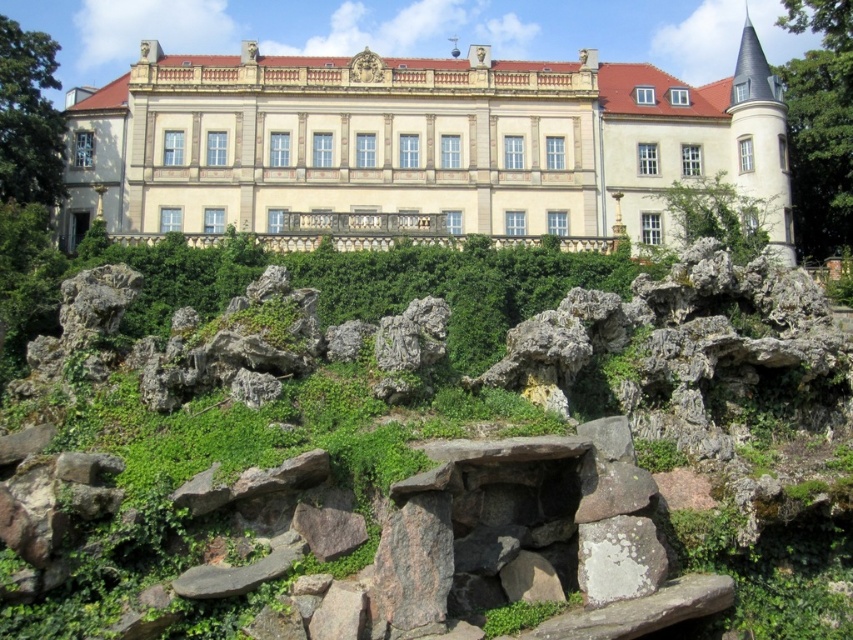
Which of these two, green mossy rocks at center or beige stone palace at center, stands shorter?

green mossy rocks at center is shorter.

Looking at this image, which is more to the right, green mossy rocks at center or beige stone palace at center?

beige stone palace at center

Is point (331, 560) positioned in front of point (550, 132)?

Yes.

Find the location of `green mossy rocks at center`. green mossy rocks at center is located at coordinates (393, 449).

Identify the location of beige stone palace at center. This screenshot has width=853, height=640. (419, 141).

Which is above, beige stone palace at center or white lichen-covered rock at center?

Positioned higher is beige stone palace at center.

What are the coordinates of `beige stone palace at center` in the screenshot? It's located at (419, 141).

Locate an element on the screen. This screenshot has height=640, width=853. beige stone palace at center is located at coordinates click(x=419, y=141).

Between point (250, 451) and point (596, 545), which one is positioned in front?

Point (596, 545)

Is green mossy rocks at center behind white lichen-covered rock at center?

No, it is not.

Which is in front, point (305, 307) or point (599, 564)?

Point (599, 564)

At what (x,y) coordinates should I click in order to perform the action: click on green mossy rocks at center. Please return your answer as a coordinate pair (x, y). This screenshot has height=640, width=853. Looking at the image, I should click on (393, 449).